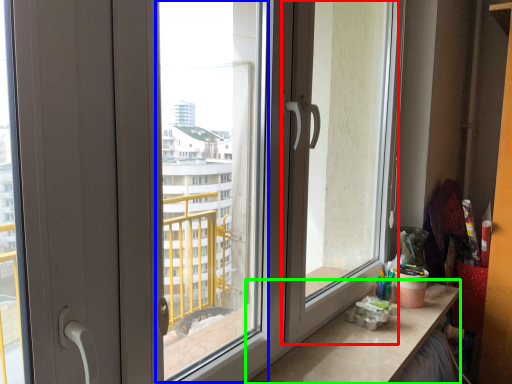
Question: Based on their relative distances, which object is farther from screen door (highlighted by a red box)? Choose from window screen (highlighted by a blue box) and counter top (highlighted by a green box).

Choices:
 (A) window screen
 (B) counter top

Answer: (A)